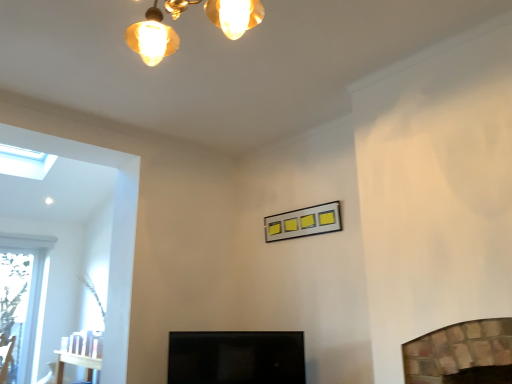
Question: In the image, is black glossy screen door at center positioned in front of or behind transparent glass skylight at upper left?

Choices:
 (A) front
 (B) behind

Answer: (A)

Question: From a real-world perspective, is black glossy screen door at center positioned above or below transparent glass skylight at upper left?

Choices:
 (A) below
 (B) above

Answer: (A)

Question: Based on their relative distances, which object is nearer to the transparent glass skylight at upper left?

Choices:
 (A) black glossy screen door at center
 (B) metallic silver picture frame at center

Answer: (B)

Question: Which is nearer to the metallic silver picture frame at center?

Choices:
 (A) transparent glass skylight at upper left
 (B) black glossy screen door at center

Answer: (B)